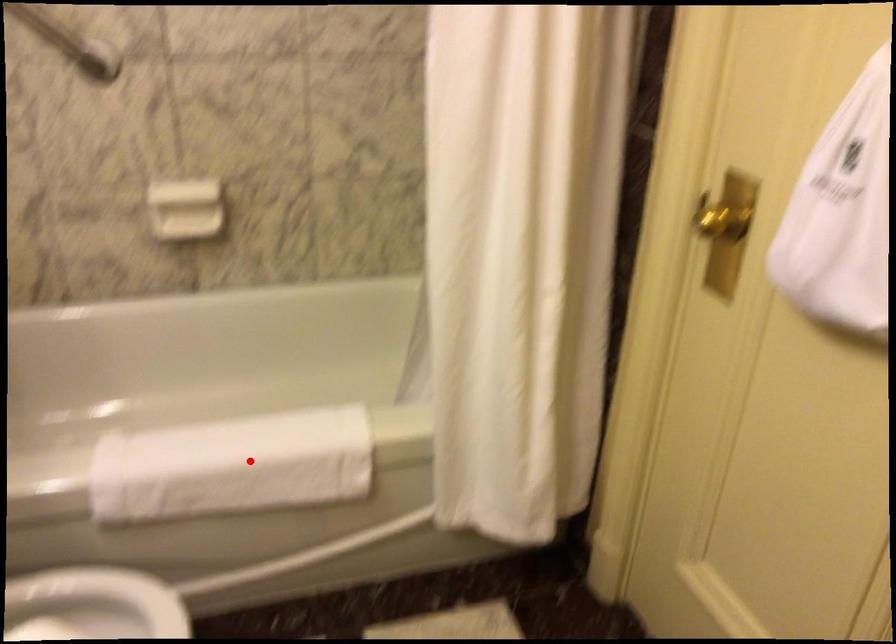
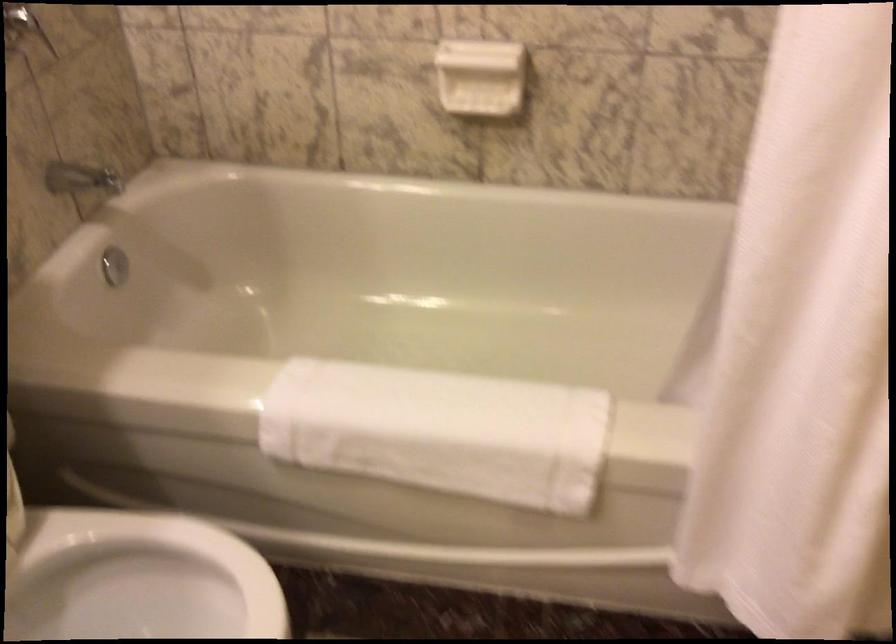
In the second image, find the point that corresponds to the highlighted location in the first image.

(440, 431)